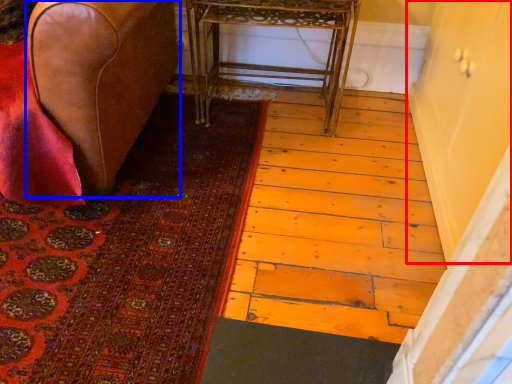
Question: Among these objects, which one is farthest to the camera, screen door (highlighted by a red box) or furniture (highlighted by a blue box)?

Choices:
 (A) screen door
 (B) furniture

Answer: (B)